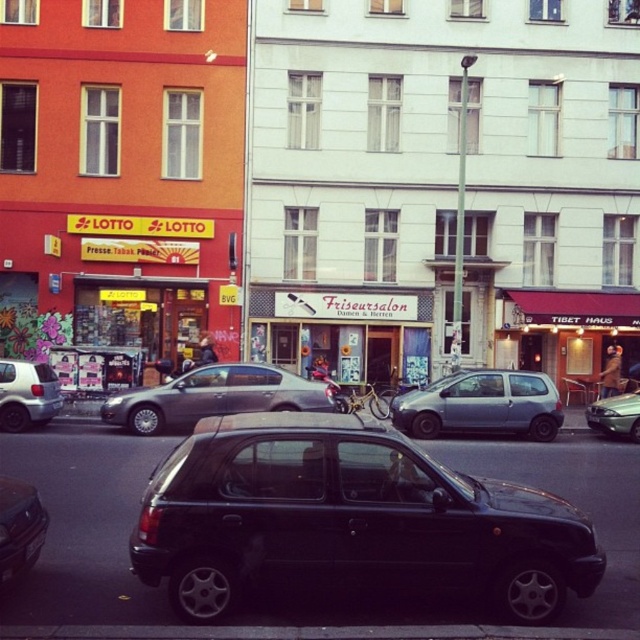
Question: Is silver metallic sedan at center closer to camera compared to white matte hatchback at left?

Choices:
 (A) no
 (B) yes

Answer: (B)

Question: Can you confirm if silver metallic sedan at center is positioned to the left of white matte hatchback at left?

Choices:
 (A) yes
 (B) no

Answer: (B)

Question: From the image, what is the correct spatial relationship of black matte car at center in relation to white matte hatchback at left?

Choices:
 (A) left
 (B) right

Answer: (B)

Question: Among these objects, which one is nearest to the camera?

Choices:
 (A) satin silver hatchback at center
 (B) black matte car at center
 (C) white matte hatchback at left

Answer: (B)

Question: Which is nearer to the metallic silver sedan at center?

Choices:
 (A) shiny black car at lower left
 (B) black matte car at center

Answer: (B)

Question: Which point is closer to the camera?

Choices:
 (A) satin silver hatchback at center
 (B) shiny black car at lower left
 (C) black matte car at center
 (D) white matte hatchback at left

Answer: (B)